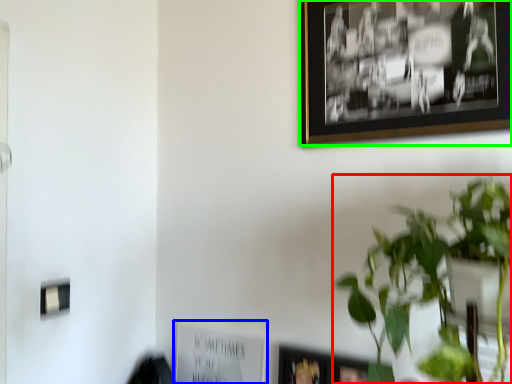
Question: Considering the real-world distances, which object is farthest from houseplant (highlighted by a red box)? picture frame (highlighted by a blue box) or picture frame (highlighted by a green box)?

Choices:
 (A) picture frame
 (B) picture frame

Answer: (A)